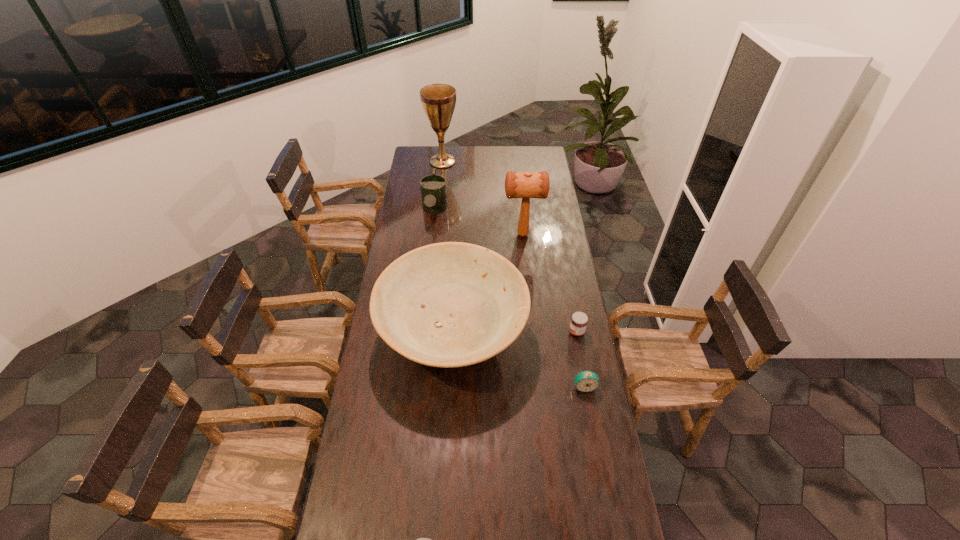
Find the location of a particular element. This screenshot has width=960, height=540. object that is the third closest one to the trophy cup is located at coordinates (452, 304).